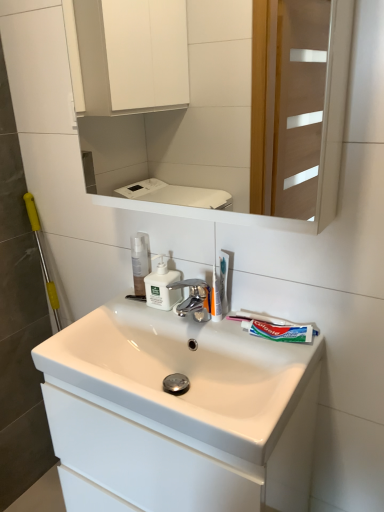
You are a GUI agent. You are given a task and a screenshot of the screen. Output one action in this format:
    pyautogui.click(x=<x>, y=<y>)
    Task: Click on the vacant space in front of transparent plastic mouthwash at center
    The height and width of the screenshot is (512, 384).
    Given the screenshot: What is the action you would take?
    pyautogui.click(x=136, y=313)